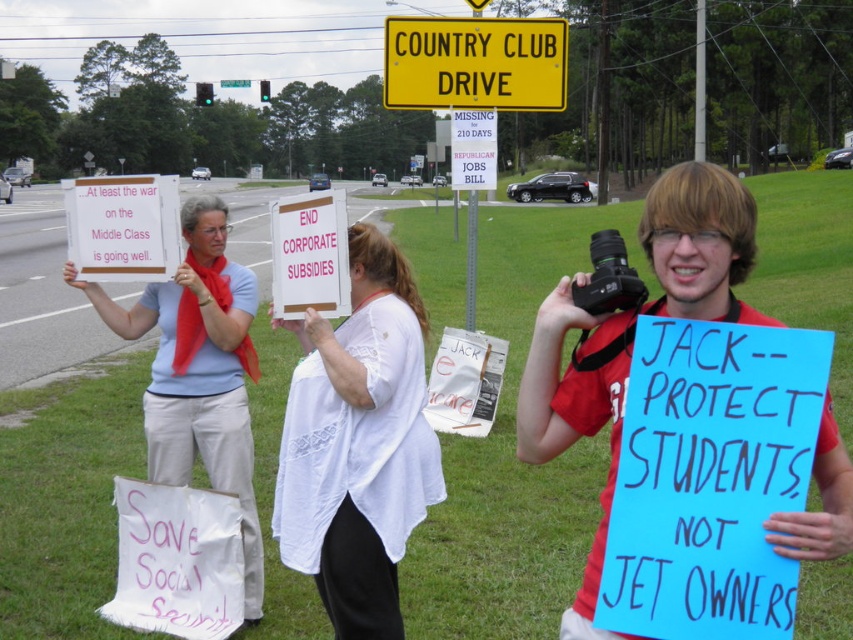
You are standing at the center of the road and see the point at coordinates point [544,324]. Can you reach it without moving more than 6 feet forward?

The point at coordinates point [544,324] is 6.71 feet from the viewer. Since 6.71 feet is more than 6 feet, you cannot reach it without moving more than 6 feet forward.